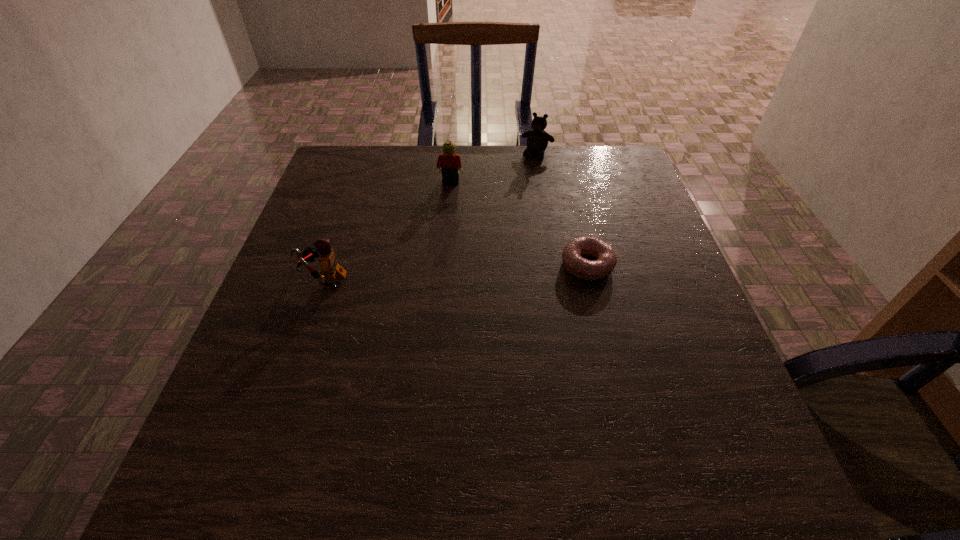
Where is `empty space that is in between the farthest object and the nearer Lego`? empty space that is in between the farthest object and the nearer Lego is located at coordinates (430, 217).

This screenshot has height=540, width=960. Find the location of `free space between the third nearest object and the teddy bear`. free space between the third nearest object and the teddy bear is located at coordinates (493, 168).

At what (x,y) coordinates should I click in order to perform the action: click on free space between the left Lego and the farther Lego. Please return your answer as a coordinate pair (x, y). Looking at the image, I should click on (387, 231).

Where is `the second closest object to the leftmost object`? The width and height of the screenshot is (960, 540). the second closest object to the leftmost object is located at coordinates (573, 262).

At what (x,y) coordinates should I click in order to perform the action: click on object that is the second closest to the teddy bear. Please return your answer as a coordinate pair (x, y). The image size is (960, 540). Looking at the image, I should click on (573, 262).